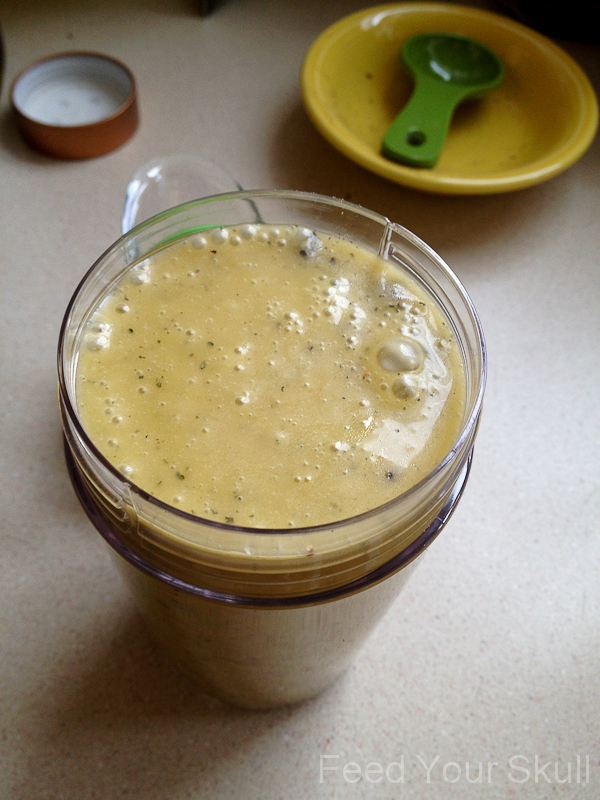
Find the location of a particular element. Image resolution: width=600 pixels, height=800 pixels. bowl is located at coordinates (490, 134).